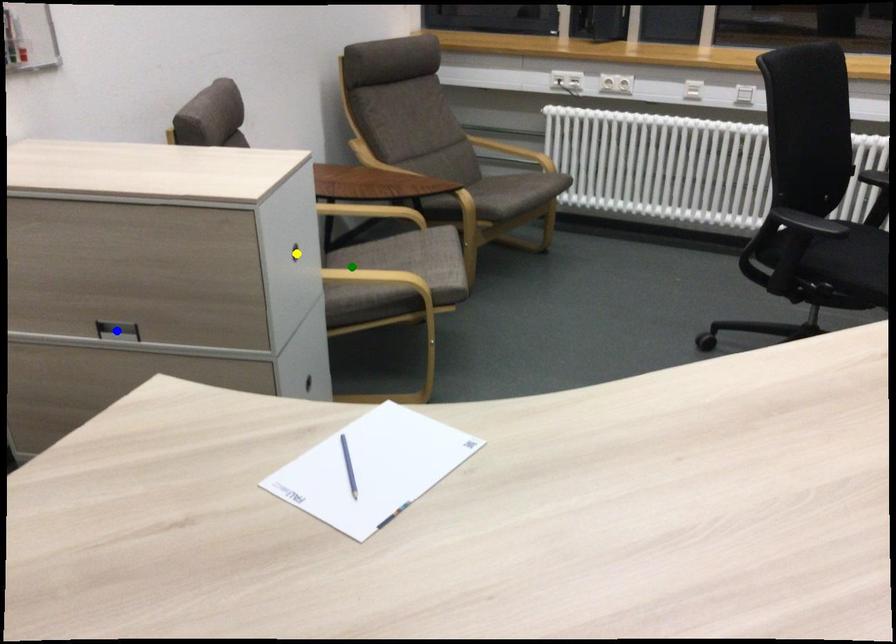
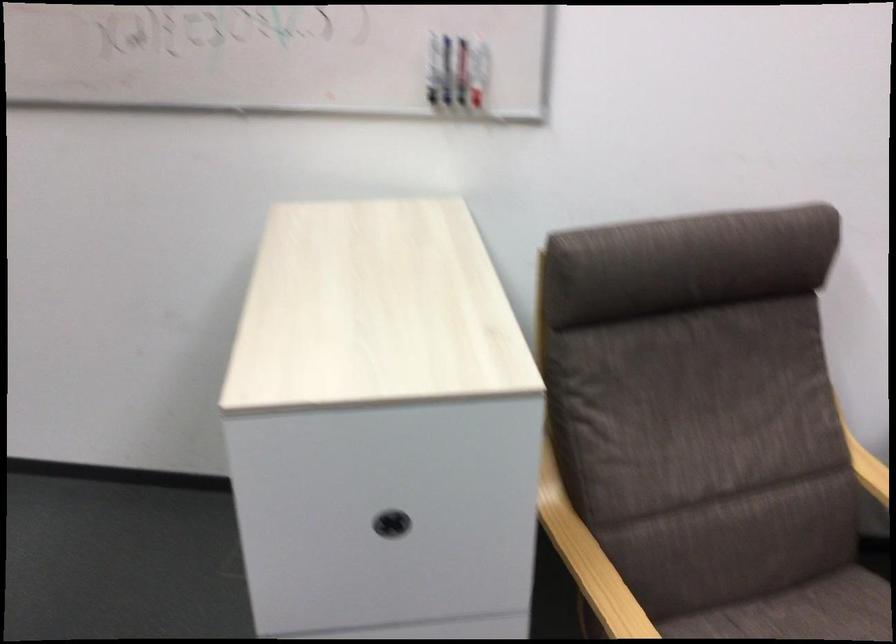
I am providing you with two images of the same scene from different viewpoints. Three points are marked in image1. Which point corresponds to a part or object that is occluded in image2?In image1, three points are marked. Which of them correspond to a part or object that is occluded in image2?Among the three points shown in image1, which one corresponds to a part or object that is no longer visible due to occlusion in image2?

Invisible in image2: blue point.